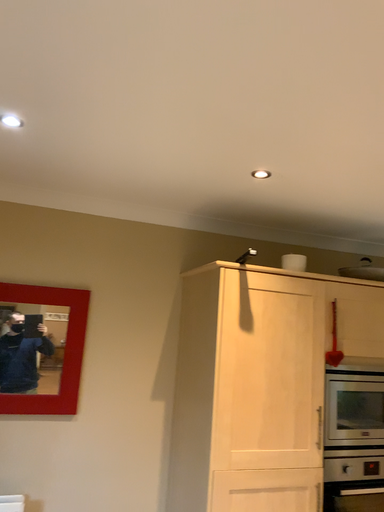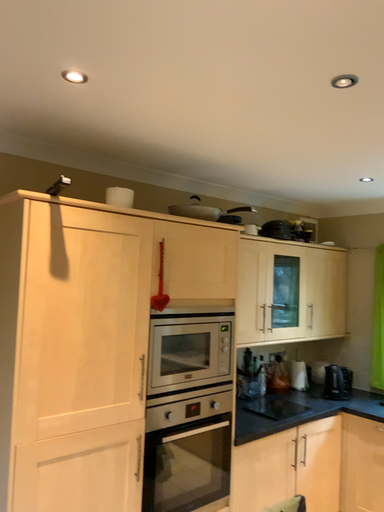
Question: Which way did the camera rotate in the video?

Choices:
 (A) rotated left
 (B) rotated right

Answer: (B)